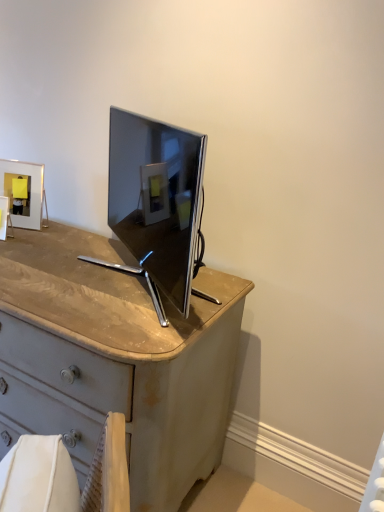
Question: Is matte silver picture frame at upper left, arranged as the 2th picture frame when viewed from the front, bigger or smaller than matte white picture frame at upper left, the 2th picture frame from the back?

Choices:
 (A) small
 (B) big

Answer: (B)

Question: Relative to matte white picture frame at upper left, positioned as the first picture frame in front-to-back order, is matte silver picture frame at upper left, arranged as the 2th picture frame when viewed from the front, in front or behind?

Choices:
 (A) behind
 (B) front

Answer: (A)

Question: From a real-world perspective, is matte silver picture frame at upper left, the first picture frame viewed from the back, physically located above or below matte white picture frame at upper left, the 2th picture frame from the back?

Choices:
 (A) below
 (B) above

Answer: (B)

Question: In the image, is matte white picture frame at upper left, positioned as the first picture frame in front-to-back order, on the left side or the right side of matte silver picture frame at upper left, the first picture frame viewed from the back?

Choices:
 (A) right
 (B) left

Answer: (B)

Question: Looking at the image, does matte white picture frame at upper left, the 2th picture frame from the back, seem bigger or smaller compared to matte silver picture frame at upper left, arranged as the 2th picture frame when viewed from the front?

Choices:
 (A) big
 (B) small

Answer: (B)

Question: Would you say matte white picture frame at upper left, positioned as the first picture frame in front-to-back order, is inside or outside matte silver picture frame at upper left, the first picture frame viewed from the back?

Choices:
 (A) outside
 (B) inside

Answer: (A)

Question: Is point (1, 200) closer or farther from the camera than point (36, 186)?

Choices:
 (A) farther
 (B) closer

Answer: (B)